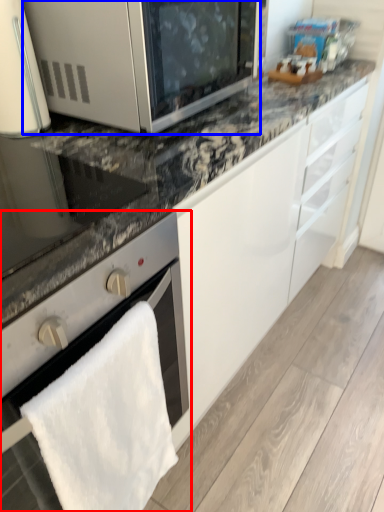
Question: Which object appears closest to the camera in this image, oven (highlighted by a red box) or microwave oven (highlighted by a blue box)?

Choices:
 (A) oven
 (B) microwave oven

Answer: (A)